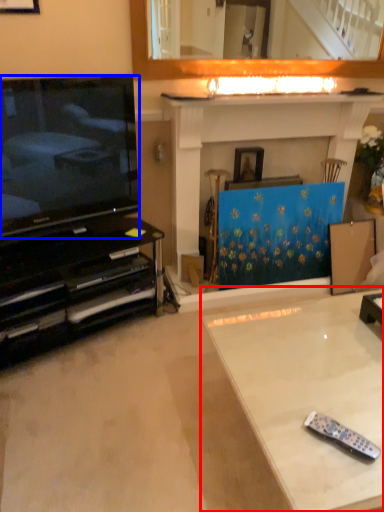
Question: Which point is further to the camera, table (highlighted by a red box) or television (highlighted by a blue box)?

Choices:
 (A) table
 (B) television

Answer: (B)